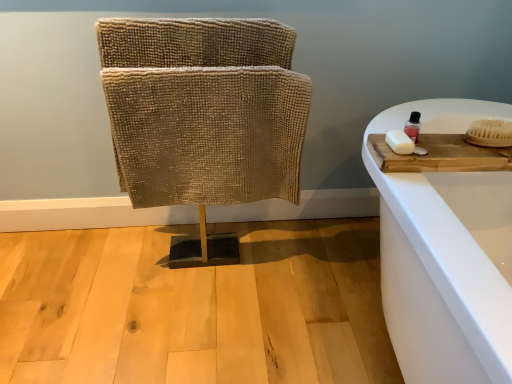
Question: Is transparent plastic bottle at upper right taller than wooden cutting board at right?

Choices:
 (A) no
 (B) yes

Answer: (B)

Question: Can you confirm if transparent plastic bottle at upper right is bigger than wooden cutting board at right?

Choices:
 (A) yes
 (B) no

Answer: (B)

Question: From a real-world perspective, is transparent plastic bottle at upper right located beneath wooden cutting board at right?

Choices:
 (A) yes
 (B) no

Answer: (B)

Question: From a real-world perspective, is transparent plastic bottle at upper right located higher than wooden cutting board at right?

Choices:
 (A) no
 (B) yes

Answer: (B)

Question: Is transparent plastic bottle at upper right to the left of wooden cutting board at right from the viewer's perspective?

Choices:
 (A) yes
 (B) no

Answer: (A)

Question: From the image's perspective, relative to white bristle brush at right, is white matte soap at right above or below?

Choices:
 (A) below
 (B) above

Answer: (A)

Question: Relative to white bristle brush at right, is white matte soap at right in front or behind?

Choices:
 (A) front
 (B) behind

Answer: (A)

Question: In terms of height, does white matte soap at right look taller or shorter compared to white bristle brush at right?

Choices:
 (A) tall
 (B) short

Answer: (B)

Question: In terms of width, does white matte soap at right look wider or thinner when compared to white bristle brush at right?

Choices:
 (A) wide
 (B) thin

Answer: (B)

Question: Is point (477, 125) positioned closer to the camera than point (153, 61)?

Choices:
 (A) farther
 (B) closer

Answer: (B)

Question: From a real-world perspective, is white bristle brush at right above or below beige textured fabric at center?

Choices:
 (A) above
 (B) below

Answer: (A)

Question: Considering the positions of white bristle brush at right and beige textured fabric at center in the image, is white bristle brush at right taller or shorter than beige textured fabric at center?

Choices:
 (A) short
 (B) tall

Answer: (A)

Question: Is white bristle brush at right bigger or smaller than beige textured fabric at center?

Choices:
 (A) big
 (B) small

Answer: (B)

Question: Choose the correct answer: Is beige textured fabric at center inside white matte soap at right or outside it?

Choices:
 (A) outside
 (B) inside

Answer: (A)

Question: From their relative heights in the image, would you say beige textured fabric at center is taller or shorter than white matte soap at right?

Choices:
 (A) short
 (B) tall

Answer: (B)